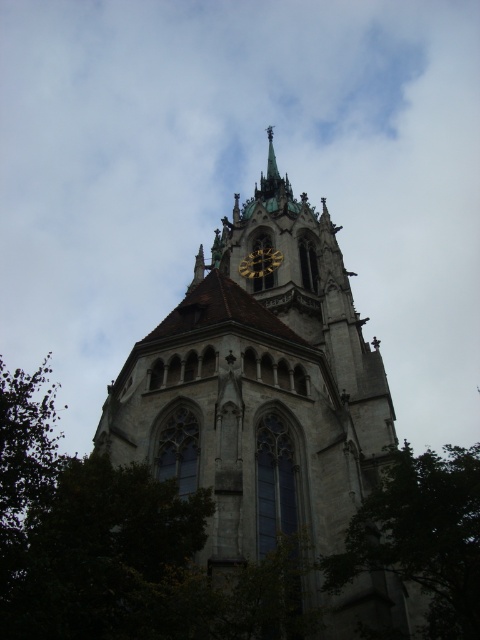
Is point (312, 394) closer to camera compared to point (182, 609)?

No, (312, 394) is further to viewer.

From the picture: Can you confirm if stone church tower at center is positioned to the right of green leafy tree at lower left?

Yes, stone church tower at center is to the right of green leafy tree at lower left.

This screenshot has height=640, width=480. I want to click on stone church tower at center, so click(x=260, y=385).

Does green leafy tree at lower left have a greater height compared to gold metallic clock at center?

Yes, green leafy tree at lower left is taller than gold metallic clock at center.

Is green leafy tree at lower left thinner than gold metallic clock at center?

No.

Identify the location of green leafy tree at lower left. point(109,557).

Can you confirm if stone church tower at center is taller than green leafy tree at lower right?

Yes, stone church tower at center is taller than green leafy tree at lower right.

Does point (302, 422) come in front of point (465, 531)?

That is False.

This screenshot has width=480, height=640. Identify the location of stone church tower at center. (260, 385).